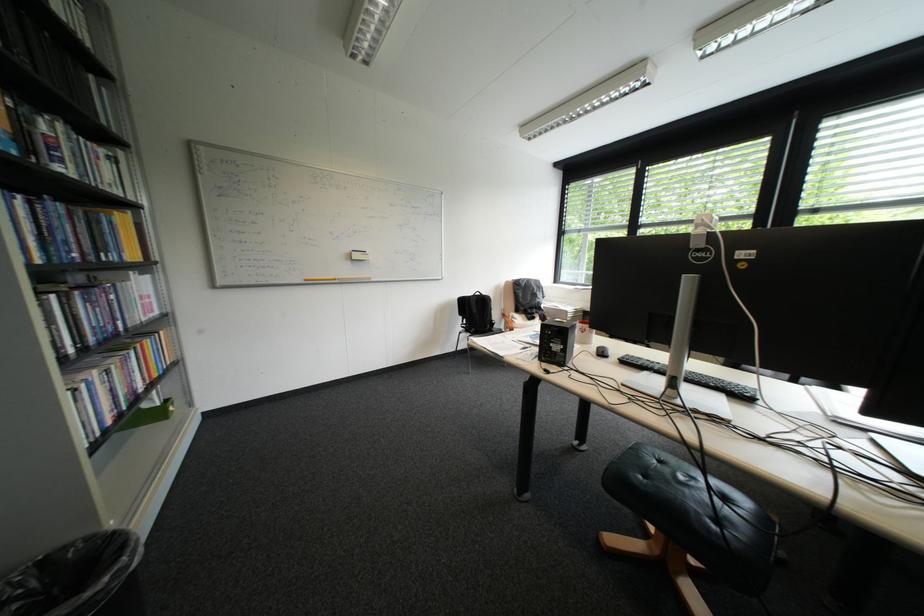
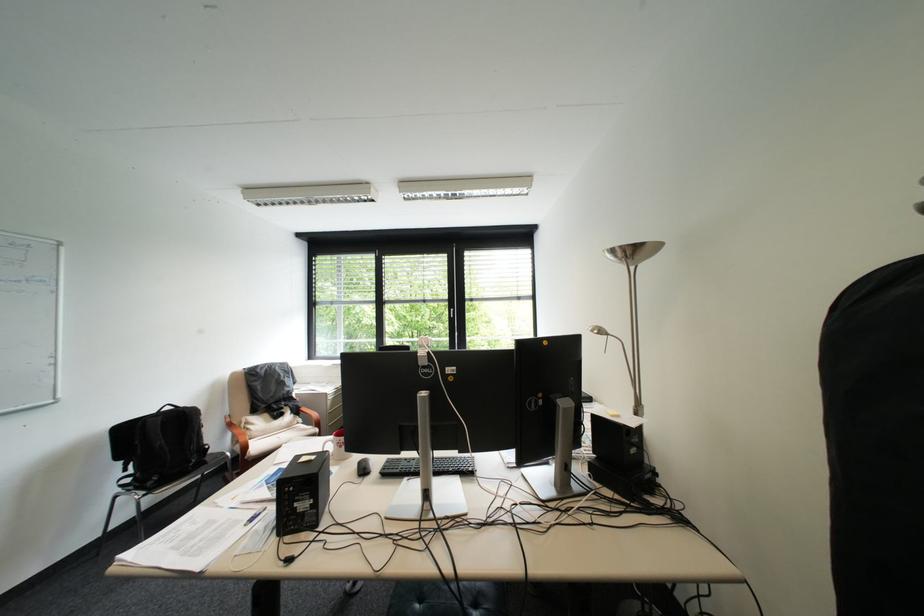
Find the pixel in the second image that matches point (724, 385) in the first image.

(463, 469)